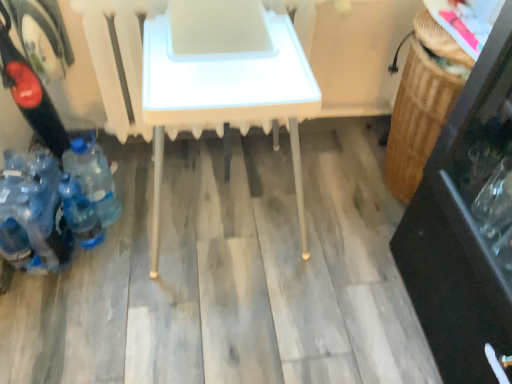
This screenshot has height=384, width=512. What are the coordinates of `free location to the right of blue plastic bottle at lower left, the 2th bottle positioned from the right` in the screenshot? It's located at (134, 250).